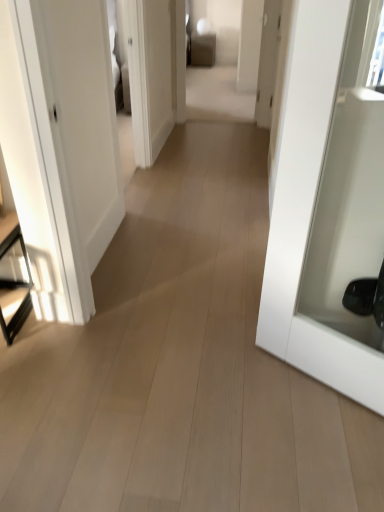
Locate an element on the screen. vacant space to the right of black glass table at left is located at coordinates (59, 335).